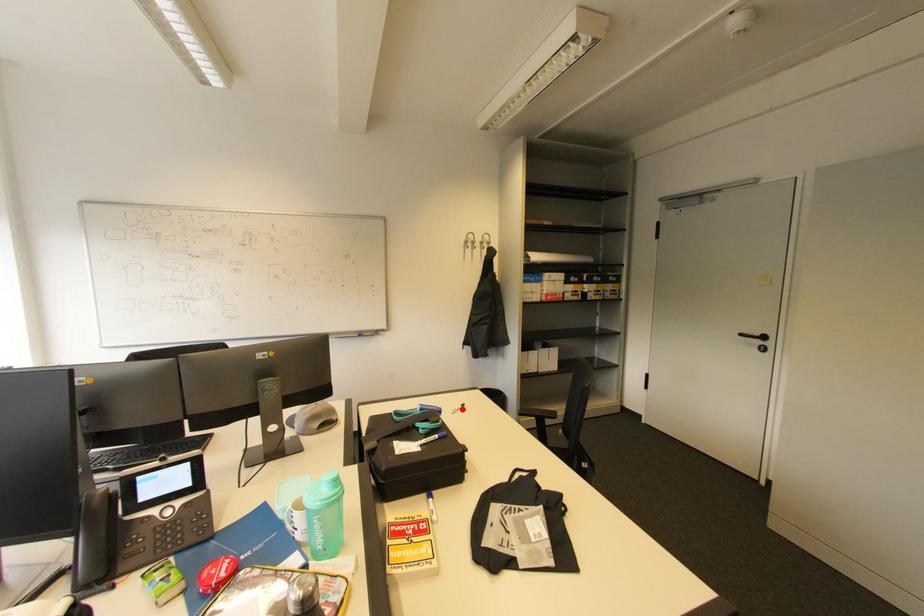
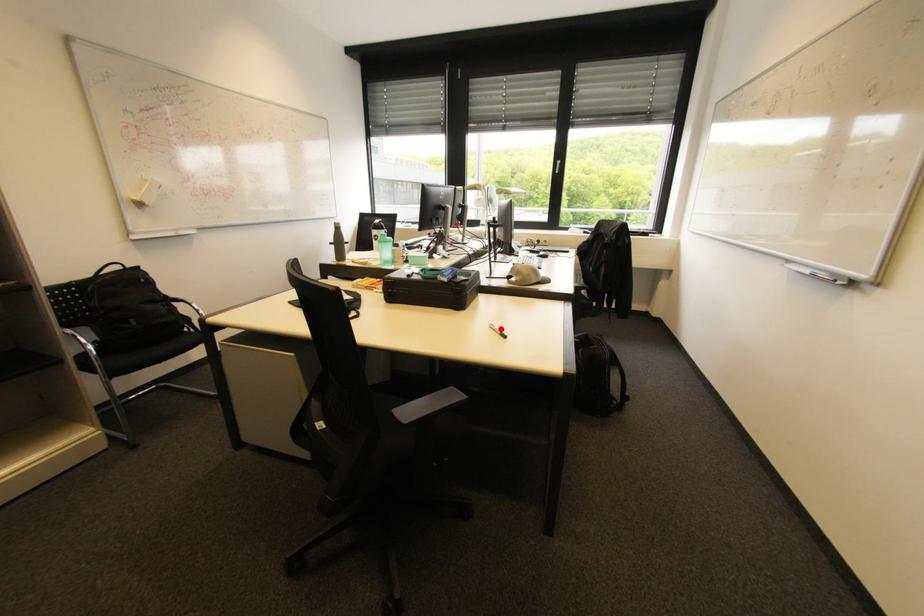
I am providing you with two images of the same scene from different viewpoints. A red point is marked on the first image and another point is marked on the second image. Does the point marked in image1 correspond to the same location as the one in image2?

Yes